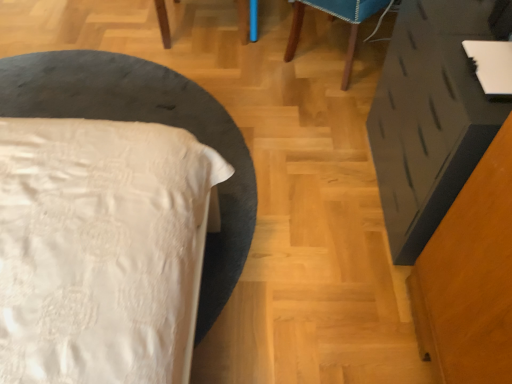
Locate an element on the screen. vacant space that is to the left of wooden chair at upper center is located at coordinates (207, 74).